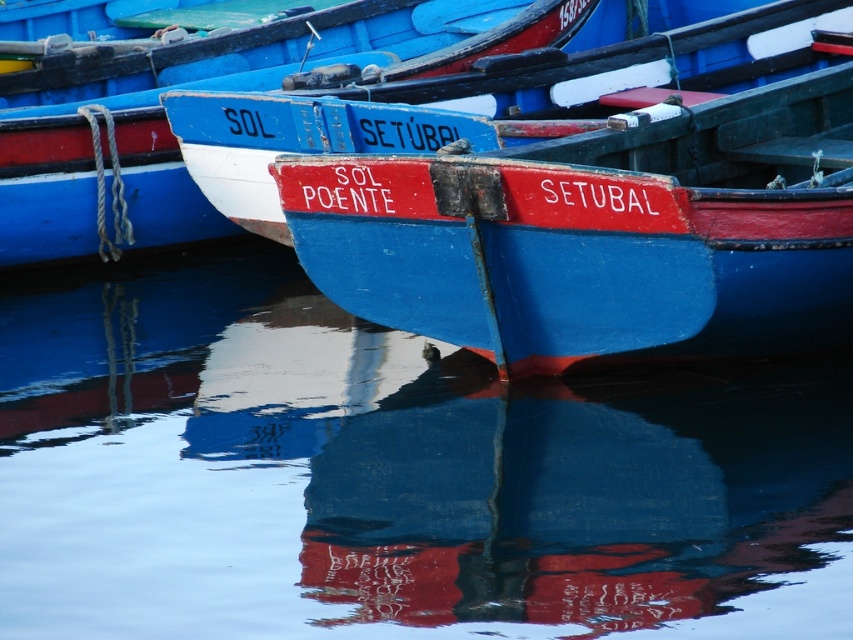
Who is lower down, glossy blue water at center or matte blue boat at center?

glossy blue water at center is lower down.

Does glossy blue water at center appear on the right side of matte blue boat at center?

Correct, you'll find glossy blue water at center to the right of matte blue boat at center.

Who is more distant from viewer, [224,442] or [9,177]?

Positioned behind is point [9,177].

At what (x,y) coordinates should I click in order to perform the action: click on glossy blue water at center. Please return your answer as a coordinate pair (x, y). This screenshot has height=640, width=853. Looking at the image, I should click on (392, 474).

Consider the image. Which is more to the right, glossy blue water at center or blue wooden boat at center?

Positioned to the right is blue wooden boat at center.

Does glossy blue water at center appear under blue wooden boat at center?

Yes, glossy blue water at center is below blue wooden boat at center.

Image resolution: width=853 pixels, height=640 pixels. I want to click on glossy blue water at center, so click(392, 474).

You are a GUI agent. You are given a task and a screenshot of the screen. Output one action in this format:
    pyautogui.click(x=<x>, y=<y>)
    Task: Click on the glossy blue water at center
    The width and height of the screenshot is (853, 640).
    Given the screenshot: What is the action you would take?
    pyautogui.click(x=392, y=474)

Describe the element at coordinates (479, 100) in the screenshot. The height and width of the screenshot is (640, 853). I see `blue wooden boat at center` at that location.

Can you confirm if blue wooden boat at center is positioned below matte blue boat at center?

Incorrect, blue wooden boat at center is not positioned below matte blue boat at center.

Which is in front, point (334, 106) or point (520, 10)?

Point (334, 106)

Identify the location of blue wooden boat at center. This screenshot has width=853, height=640. (479, 100).